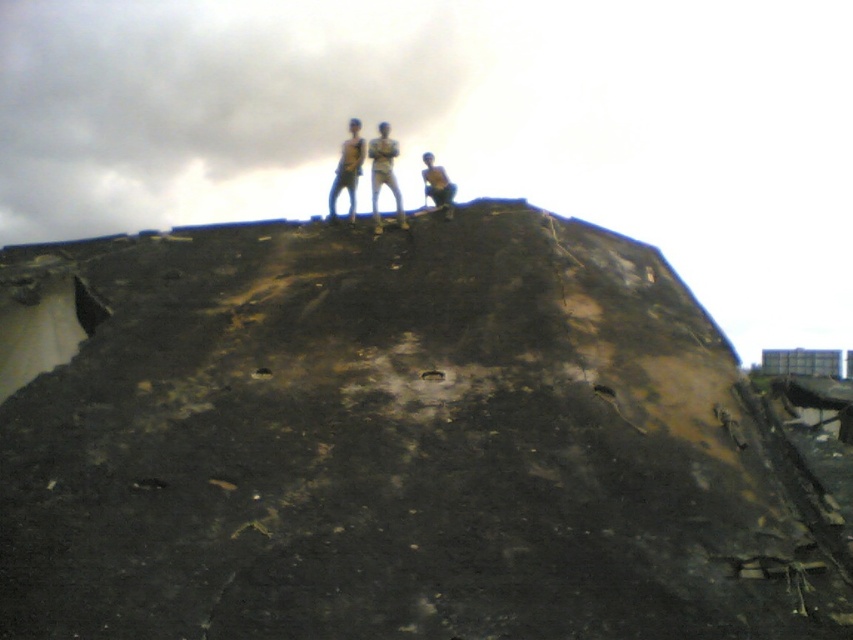
Consider the image. You are standing at the base of the charcoal textured mound at upper center. Which direction should you walk to reach the top?

The charcoal textured mound at upper center is located at point (393, 442), so you should walk towards the upper center direction to reach the top.

You are standing at the base of the mound and want to reach the person wearing the light brown jeans at center and the brown leather jacket at upper center. Which person will you encounter first as you climb the slope?

You will encounter the light brown jeans at center first because it is closer to the viewer than the brown leather jacket at upper center.

You are a photographer trying to capture a photo of the light brown jeans at center and the light brown skin at center. Which object should you focus on first if you want to ensure both are in focus without adjusting the camera settings?

The light brown jeans at center has a lesser height compared to light brown skin at center, so you should focus on the light brown skin at center first because it is farther away, ensuring the depth of field captures both subjects.